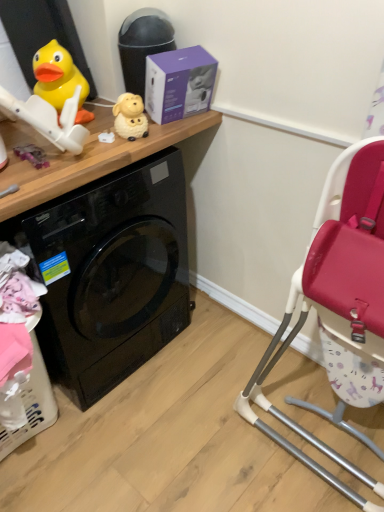
This screenshot has height=512, width=384. Identify the location of empty space that is to the right of purple fabric toy at left, which is the 1th toy in left-to-right order. coord(86,156).